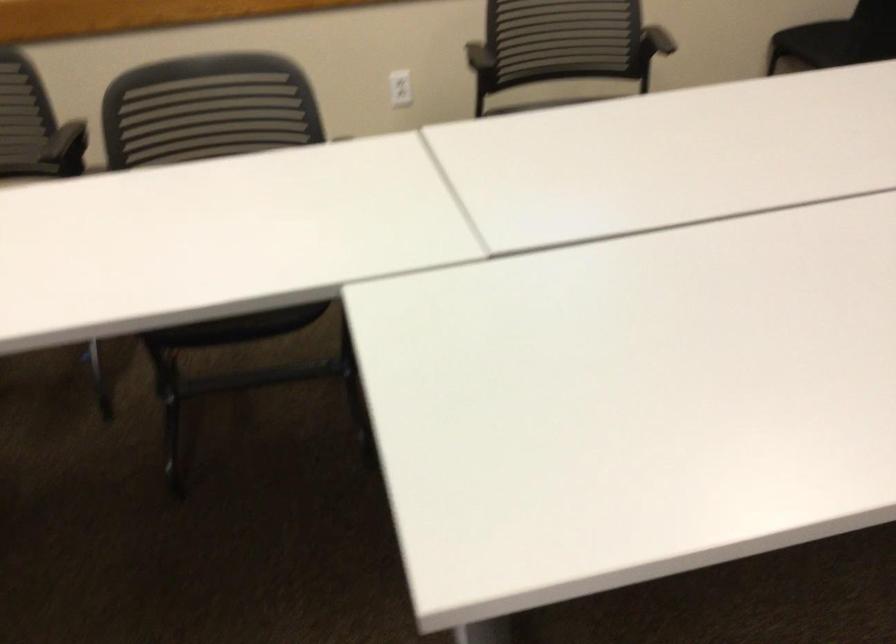
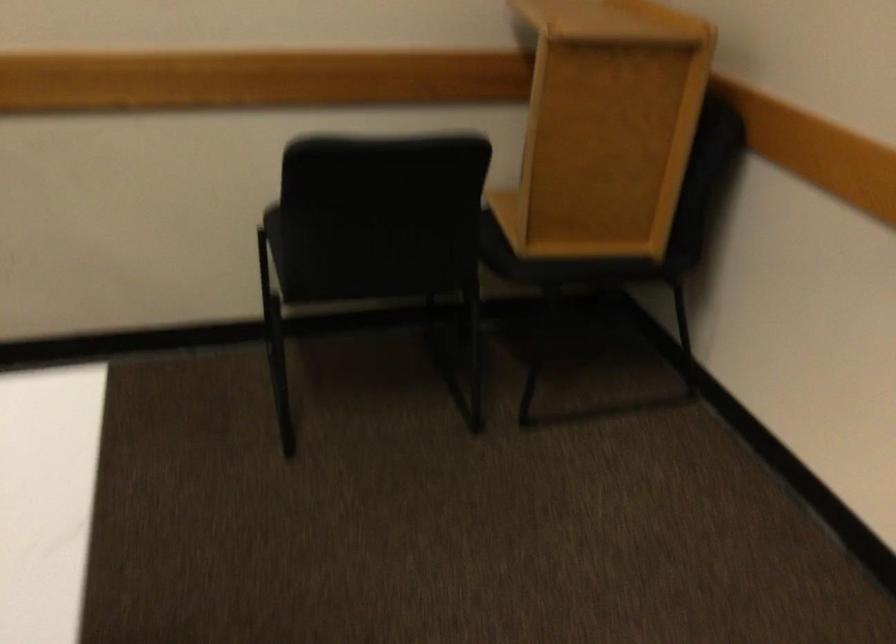
The images are taken continuously from a first-person perspective. In which direction are you moving?

The cameraman moved toward right, forward.